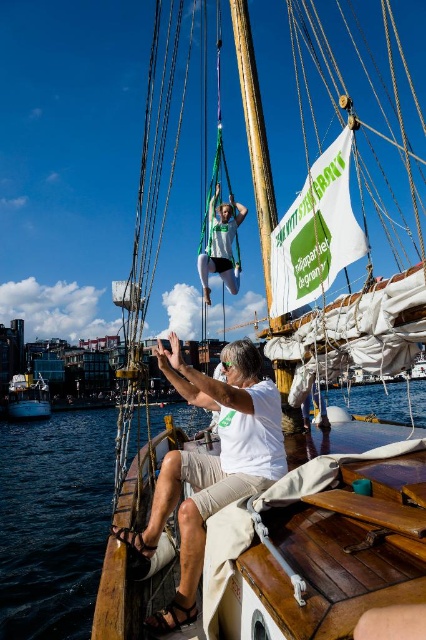
Question: Is white cotton shirt at center bigger than white glossy boat at lower left?

Choices:
 (A) yes
 (B) no

Answer: (A)

Question: Which of these objects is positioned farthest from the white cotton shirt at center?

Choices:
 (A) wooden mast at upper center
 (B) blue water at lower left
 (C) green fabric harness at center
 (D) dark blue water at lower left

Answer: (B)

Question: Is blue water at lower left to the left of green fabric harness at center from the viewer's perspective?

Choices:
 (A) no
 (B) yes

Answer: (A)

Question: Does wooden mast at upper center appear on the right side of blue water at lower left?

Choices:
 (A) yes
 (B) no

Answer: (B)

Question: Among these points, which one is nearest to the camera?

Choices:
 (A) (356, 396)
 (B) (238, 6)

Answer: (B)

Question: Which object is farther from the camera taking this photo?

Choices:
 (A) wooden mast at upper center
 (B) blue water at lower left

Answer: (B)